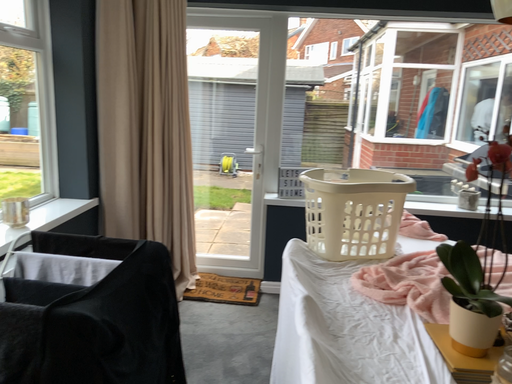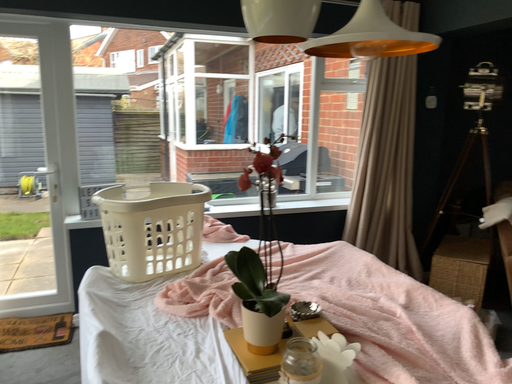
Question: Which way did the camera rotate in the video?

Choices:
 (A) rotated left
 (B) rotated right

Answer: (B)